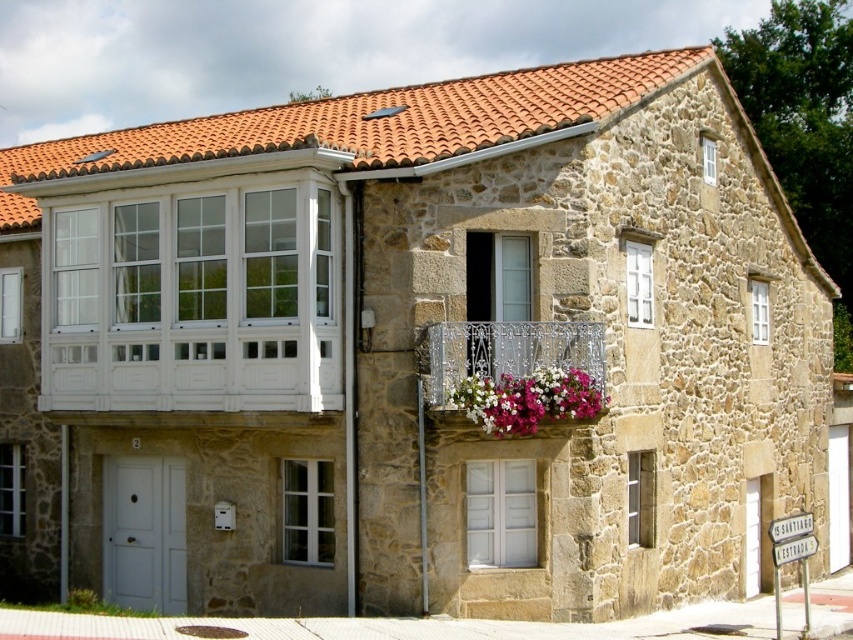
You are a visitor approaching the traditional stone house. You notice the wrought iron balcony at center and the pink fabric flowers at center. Which object would block your view more if you were standing directly in front of them?

The wrought iron balcony at center has a larger size compared to the pink fabric flowers at center, so it would block your view more.